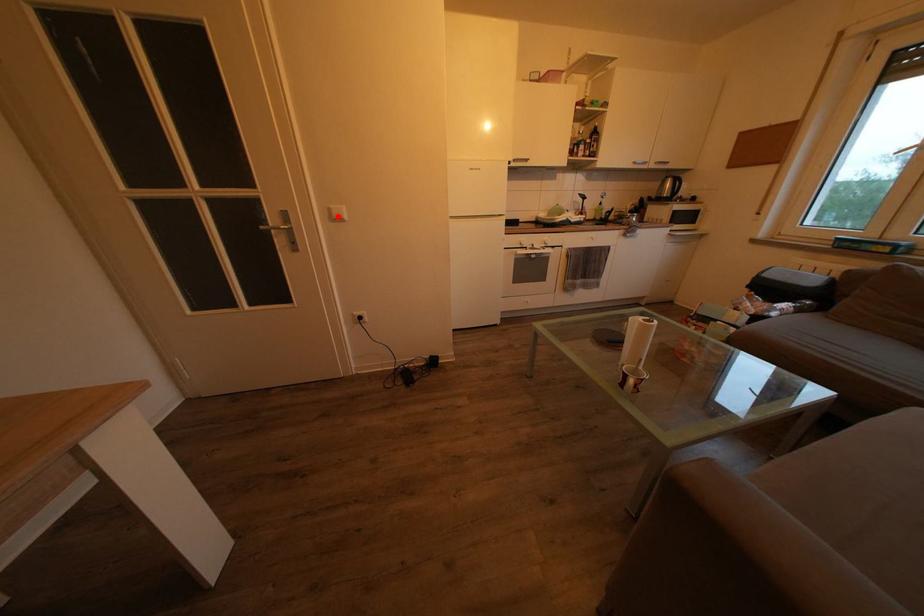
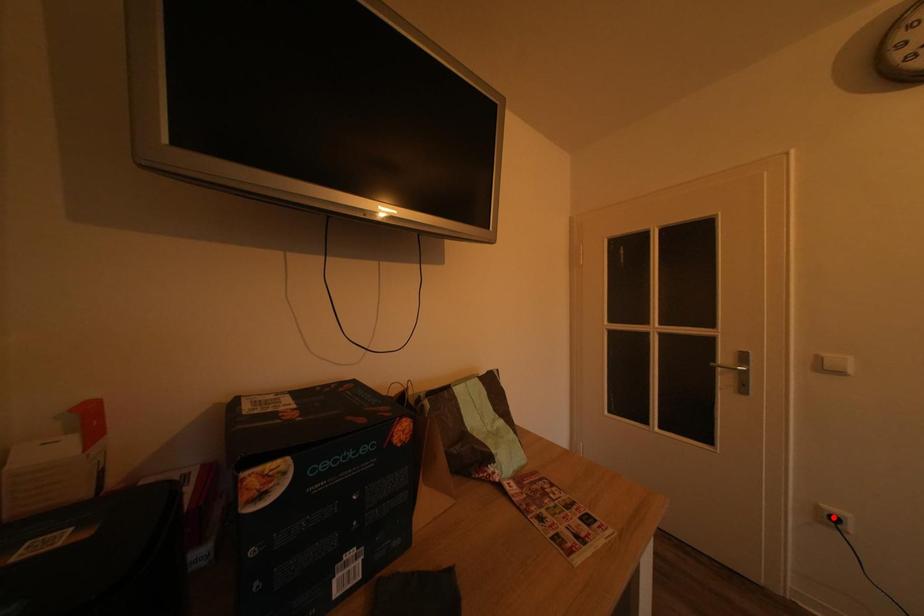
I am providing you with two images of the same scene from different viewpoints. A red point is marked on the first image and another point is marked on the second image. Do the highlighted points in image1 and image2 indicate the same real-world spot?

No